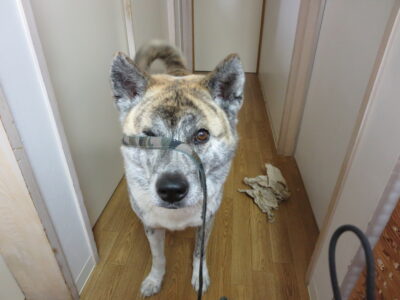
At what (x,y) coordinates should I click in order to perform the action: click on door. Please return your answer as a coordinate pair (x, y). The width and height of the screenshot is (400, 300). Looking at the image, I should click on (233, 13), (83, 60), (344, 92).